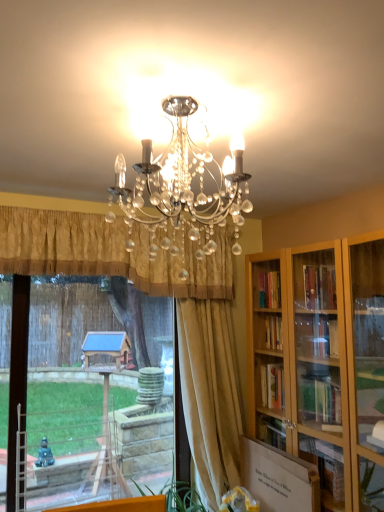
Where is `silky beige curtain at center, positioned as the first curtain in right-to-left order`? This screenshot has width=384, height=512. silky beige curtain at center, positioned as the first curtain in right-to-left order is located at coordinates (210, 395).

The width and height of the screenshot is (384, 512). I want to click on silky beige curtain at center, positioned as the first curtain in right-to-left order, so click(210, 395).

How distant is silky beige curtain at center, positioned as the second curtain in left-to-right order, from gold pleated curtain at center, placed as the first curtain when sorted from left to right?

silky beige curtain at center, positioned as the second curtain in left-to-right order, is 57.97 centimeters from gold pleated curtain at center, placed as the first curtain when sorted from left to right.

Who is bigger, silky beige curtain at center, positioned as the second curtain in left-to-right order, or gold pleated curtain at center, placed as the first curtain when sorted from left to right?

Bigger between the two is gold pleated curtain at center, placed as the first curtain when sorted from left to right.

Can you confirm if silky beige curtain at center, positioned as the first curtain in right-to-left order, is taller than gold pleated curtain at center, acting as the 2th curtain starting from the right?

Yes, silky beige curtain at center, positioned as the first curtain in right-to-left order, is taller than gold pleated curtain at center, acting as the 2th curtain starting from the right.

In the scene shown: From a real-world perspective, who is located lower, silky beige curtain at center, positioned as the second curtain in left-to-right order, or gold pleated curtain at center, placed as the first curtain when sorted from left to right?

From a 3D spatial view, silky beige curtain at center, positioned as the second curtain in left-to-right order, is below.

In the scene shown: How different are the orientations of gold pleated curtain at center, placed as the first curtain when sorted from left to right, and silky beige curtain at center, positioned as the second curtain in left-to-right order, in degrees?

The angular difference between gold pleated curtain at center, placed as the first curtain when sorted from left to right, and silky beige curtain at center, positioned as the second curtain in left-to-right order, is 5.37 degrees.

Is gold pleated curtain at center, acting as the 2th curtain starting from the right, surrounding silky beige curtain at center, positioned as the second curtain in left-to-right order?

No.

Is gold pleated curtain at center, placed as the first curtain when sorted from left to right, thinner than silky beige curtain at center, positioned as the first curtain in right-to-left order?

No, gold pleated curtain at center, placed as the first curtain when sorted from left to right, is not thinner than silky beige curtain at center, positioned as the first curtain in right-to-left order.

Looking at the image, does gold pleated curtain at center, placed as the first curtain when sorted from left to right, seem bigger or smaller compared to silky beige curtain at center, positioned as the first curtain in right-to-left order?

Clearly, gold pleated curtain at center, placed as the first curtain when sorted from left to right, is larger in size than silky beige curtain at center, positioned as the first curtain in right-to-left order.

Is transparent glass window at center not inside silky beige curtain at center, positioned as the second curtain in left-to-right order?

Yes, transparent glass window at center is outside of silky beige curtain at center, positioned as the second curtain in left-to-right order.

Is the position of transparent glass window at center more distant than that of silky beige curtain at center, positioned as the first curtain in right-to-left order?

No, it is not.

From a real-world perspective, is transparent glass window at center above or below silky beige curtain at center, positioned as the second curtain in left-to-right order?

From a real-world perspective, transparent glass window at center is physically below silky beige curtain at center, positioned as the second curtain in left-to-right order.

Who is shorter, transparent glass window at center or silky beige curtain at center, positioned as the first curtain in right-to-left order?

Standing shorter between the two is transparent glass window at center.

What's the angular difference between silky beige curtain at center, positioned as the first curtain in right-to-left order, and transparent glass window at center's facing directions?

silky beige curtain at center, positioned as the first curtain in right-to-left order, and transparent glass window at center are facing 2.76 degrees away from each other.

In terms of width, does silky beige curtain at center, positioned as the second curtain in left-to-right order, look wider or thinner when compared to transparent glass window at center?

In the image, silky beige curtain at center, positioned as the second curtain in left-to-right order, appears to be wider than transparent glass window at center.

Can you confirm if silky beige curtain at center, positioned as the second curtain in left-to-right order, is taller than transparent glass window at center?

Indeed, silky beige curtain at center, positioned as the second curtain in left-to-right order, has a greater height compared to transparent glass window at center.

From the image's perspective, between transparent glass window at center and gold pleated curtain at center, acting as the 2th curtain starting from the right, which one is located above?

gold pleated curtain at center, acting as the 2th curtain starting from the right, is shown above in the image.

Which of these two, transparent glass window at center or gold pleated curtain at center, acting as the 2th curtain starting from the right, stands taller?

With more height is transparent glass window at center.

Would you say transparent glass window at center is outside gold pleated curtain at center, acting as the 2th curtain starting from the right?

Yes, transparent glass window at center is located beyond the bounds of gold pleated curtain at center, acting as the 2th curtain starting from the right.

In terms of height, does gold pleated curtain at center, acting as the 2th curtain starting from the right, look taller or shorter compared to transparent glass window at center?

Clearly, gold pleated curtain at center, acting as the 2th curtain starting from the right, is shorter compared to transparent glass window at center.

Does point (24, 270) lie in front of point (217, 419)?

Yes, it is in front of point (217, 419).

Would you say transparent glass window at center is part of gold pleated curtain at center, acting as the 2th curtain starting from the right,'s contents?

No.

Locate an element on the screen. curtain lying on the left of silky beige curtain at center, positioned as the second curtain in left-to-right order is located at coordinates (110, 253).

Find the location of a particular element. The image size is (384, 512). curtain in front of the silky beige curtain at center, positioned as the first curtain in right-to-left order is located at coordinates (110, 253).

Which object lies further to the anchor point transparent glass window at center, silky beige curtain at center, positioned as the second curtain in left-to-right order, or gold pleated curtain at center, acting as the 2th curtain starting from the right?

silky beige curtain at center, positioned as the second curtain in left-to-right order, is further to transparent glass window at center.

Looking at the image, which one is located further to silky beige curtain at center, positioned as the second curtain in left-to-right order, transparent glass window at center or gold pleated curtain at center, acting as the 2th curtain starting from the right?

gold pleated curtain at center, acting as the 2th curtain starting from the right, is positioned further to the anchor silky beige curtain at center, positioned as the second curtain in left-to-right order.

Looking at the image, which one is located closer to silky beige curtain at center, positioned as the first curtain in right-to-left order, gold pleated curtain at center, acting as the 2th curtain starting from the right, or transparent glass window at center?

Based on the image, transparent glass window at center appears to be nearer to silky beige curtain at center, positioned as the first curtain in right-to-left order.

Based on their spatial positions, is transparent glass window at center or silky beige curtain at center, positioned as the second curtain in left-to-right order, closer to gold pleated curtain at center, placed as the first curtain when sorted from left to right?

Based on the image, transparent glass window at center appears to be nearer to gold pleated curtain at center, placed as the first curtain when sorted from left to right.

From the image, which object appears to be farther from transparent glass window at center, gold pleated curtain at center, acting as the 2th curtain starting from the right, or silky beige curtain at center, positioned as the second curtain in left-to-right order?

silky beige curtain at center, positioned as the second curtain in left-to-right order, is further to transparent glass window at center.

Which object lies further to the anchor point gold pleated curtain at center, placed as the first curtain when sorted from left to right, silky beige curtain at center, positioned as the second curtain in left-to-right order, or transparent glass window at center?

The object further to gold pleated curtain at center, placed as the first curtain when sorted from left to right, is silky beige curtain at center, positioned as the second curtain in left-to-right order.

You are a GUI agent. You are given a task and a screenshot of the screen. Output one action in this format:
    pyautogui.click(x=<x>, y=<y>)
    Task: Click on the curtain between gold pleated curtain at center, placed as the first curtain when sorted from left to right, and transparent glass window at center vertically
    
    Given the screenshot: What is the action you would take?
    pyautogui.click(x=210, y=395)